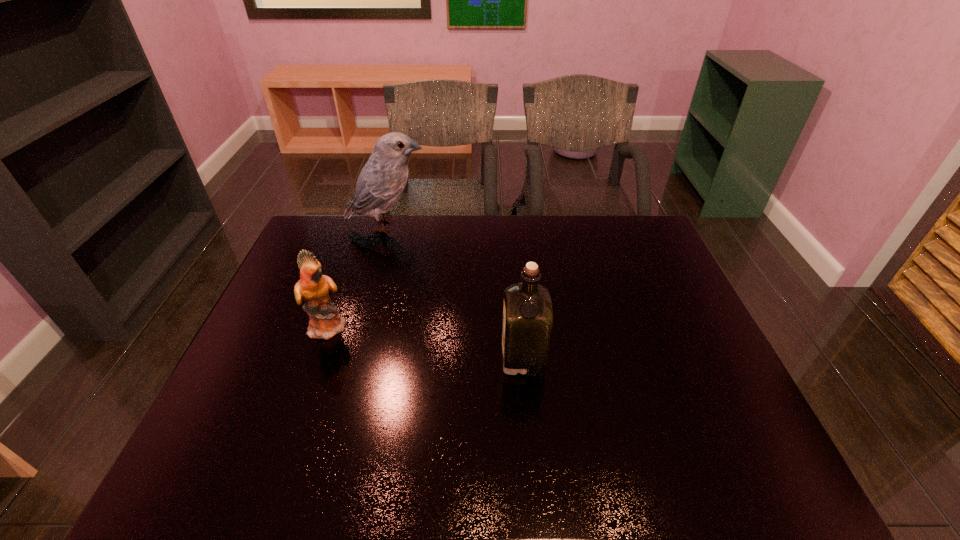
The image size is (960, 540). I want to click on blank region between the rightmost object and the farthest object, so click(x=455, y=291).

Identify the location of unoccupied position between the nearer parrot and the farther parrot. (358, 276).

The image size is (960, 540). Find the location of `vacant point located between the nearer parrot and the rightmost object`. vacant point located between the nearer parrot and the rightmost object is located at coordinates (426, 341).

Identify the location of free spot between the liquor and the nearer parrot. (426, 341).

The height and width of the screenshot is (540, 960). I want to click on vacant area that lies between the liquor and the taller parrot, so click(455, 291).

Identify the location of vacant area that lies between the nearer parrot and the farthest object. The height and width of the screenshot is (540, 960). (358, 276).

The height and width of the screenshot is (540, 960). Identify the location of free space between the nearer parrot and the liquor. (426, 341).

Identify which object is the second nearest to the rightmost object. Please provide its 2D coordinates. Your answer should be formatted as a tuple, i.e. [(x, y)], where the tuple contains the x and y coordinates of a point satisfying the conditions above.

[(381, 181)]

Identify the location of object that stands as the second closest to the farthest object. (527, 313).